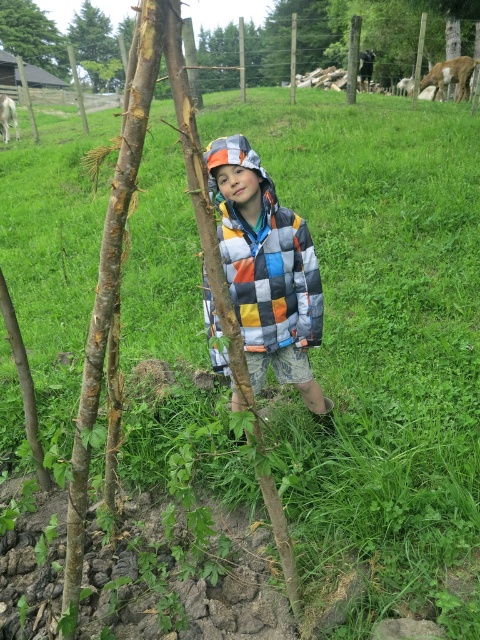
Locate an element on the screen. patchwork quilted jacket at center is located at coordinates (266, 269).

The image size is (480, 640). What do you see at coordinates (266, 269) in the screenshot?
I see `patchwork quilted jacket at center` at bounding box center [266, 269].

You are a GUI agent. You are given a task and a screenshot of the screen. Output one action in this format:
    pyautogui.click(x=<x>, y=<y>)
    Task: Click on the patchwork quilted jacket at center
    Image resolution: width=480 pixels, height=640 pixels.
    Given the screenshot: What is the action you would take?
    click(266, 269)

Can you confirm if patchwork quilted jacket at center is bigger than green textured tree at upper left?

Indeed, patchwork quilted jacket at center has a larger size compared to green textured tree at upper left.

Consider the image. Is patchwork quilted jacket at center smaller than green textured tree at upper left?

No, patchwork quilted jacket at center is not smaller than green textured tree at upper left.

What do you see at coordinates (266, 269) in the screenshot?
I see `patchwork quilted jacket at center` at bounding box center [266, 269].

The width and height of the screenshot is (480, 640). Identify the location of patchwork quilted jacket at center. (266, 269).

Is brown fur goat at upper right smaller than white woolen sweater at upper left?

No.

Describe the element at coordinates (451, 76) in the screenshot. I see `brown fur goat at upper right` at that location.

Based on the photo, who is more forward, (424, 74) or (11, 104)?

Point (11, 104)

Find the location of a particular element. Image resolution: width=480 pixels, height=640 pixels. brown fur goat at upper right is located at coordinates pos(451,76).